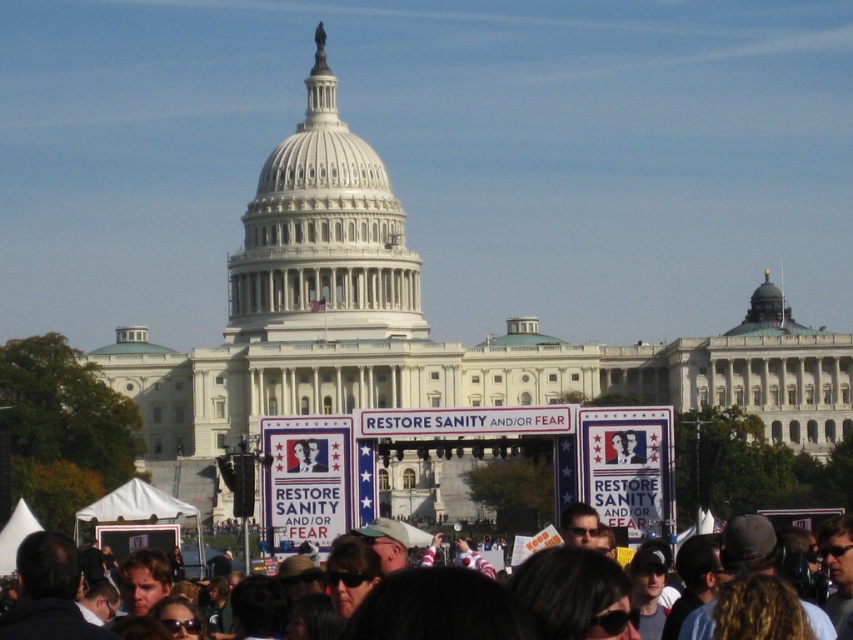
Question: Considering the real-world distances, which object is farthest from the white paper sign at center?

Choices:
 (A) dark gray hair at lower center
 (B) blue fabric sign at center

Answer: (A)

Question: Which is nearer to the dark gray hair at lower center?

Choices:
 (A) blue fabric sign at center
 (B) white paper sign at center

Answer: (A)

Question: Which of the following is the closest to the observer?

Choices:
 (A) dark gray hair at lower center
 (B) white paper sign at center

Answer: (A)

Question: Is white paper sign at center bigger than dark gray hair at lower center?

Choices:
 (A) no
 (B) yes

Answer: (A)

Question: Where is blue fabric sign at center located in relation to white paper sign at center in the image?

Choices:
 (A) above
 (B) below

Answer: (B)

Question: Considering the relative positions of blue fabric sign at center and dark gray hair at lower center in the image provided, where is blue fabric sign at center located with respect to dark gray hair at lower center?

Choices:
 (A) above
 (B) below

Answer: (A)